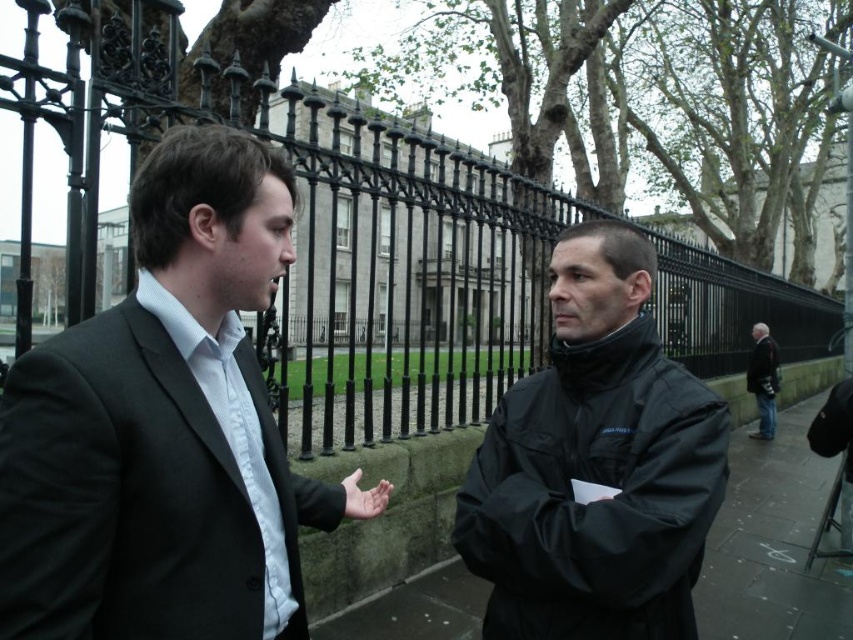
How much distance is there between matte black suit at left and black matte jacket at center?

matte black suit at left and black matte jacket at center are 3.56 meters apart.

Is point (132, 298) farther from viewer compared to point (509, 522)?

No, (132, 298) is in front of (509, 522).

In order to click on matte black suit at left in this screenshot , I will do `click(166, 428)`.

Where is `matte black suit at left`? The image size is (853, 640). matte black suit at left is located at coordinates (166, 428).

Does black wrought iron fence at center appear over black fabric jacket at center?

Indeed, black wrought iron fence at center is positioned over black fabric jacket at center.

This screenshot has height=640, width=853. Describe the element at coordinates (405, 282) in the screenshot. I see `black wrought iron fence at center` at that location.

Find the location of a particular element. The width and height of the screenshot is (853, 640). black wrought iron fence at center is located at coordinates (405, 282).

The width and height of the screenshot is (853, 640). What are the coordinates of `black wrought iron fence at center` in the screenshot? It's located at (405, 282).